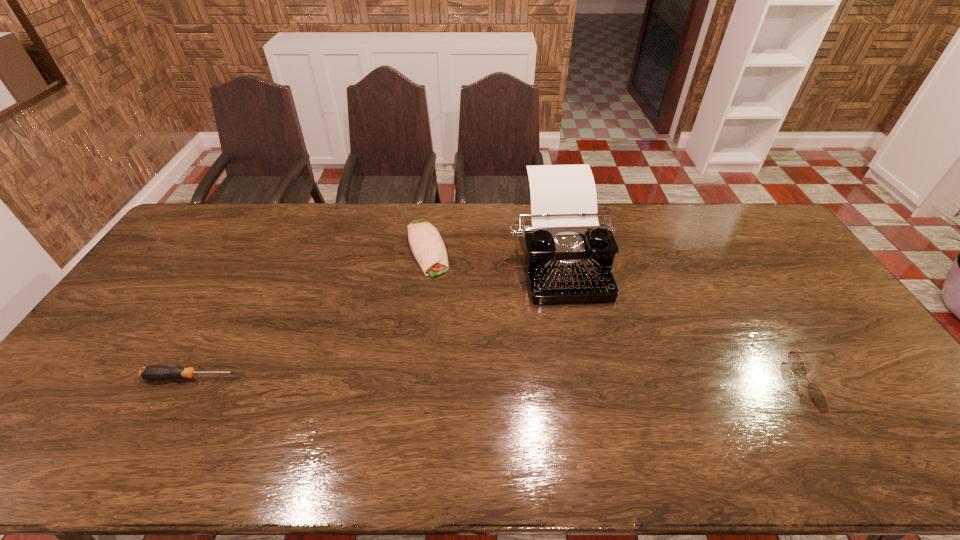
This screenshot has height=540, width=960. Find the location of `object situated at the right edge`. object situated at the right edge is located at coordinates (816, 395).

Locate an element on the screen. object that is at the near right corner is located at coordinates (816, 395).

This screenshot has height=540, width=960. What are the coordinates of `vacant space at the far edge` in the screenshot? It's located at (706, 228).

Image resolution: width=960 pixels, height=540 pixels. I want to click on free spot at the near edge of the desktop, so pos(627,394).

Locate an element on the screen. The image size is (960, 540). free region at the left edge of the desktop is located at coordinates (114, 352).

Identify the location of free location at the right edge of the desktop. The image size is (960, 540). (768, 283).

The height and width of the screenshot is (540, 960). What are the coordinates of `vacant area at the near right corner of the desktop` in the screenshot? It's located at (887, 420).

Find the location of a particular element. The height and width of the screenshot is (540, 960). free spot between the third object from left to right and the screwdriver is located at coordinates (375, 317).

Find the location of a particular element. The image size is (960, 540). free space between the third object from right to left and the sunglasses is located at coordinates (627, 318).

This screenshot has height=540, width=960. In order to click on free space between the screwdriver and the typewriter in this screenshot , I will do `click(375, 317)`.